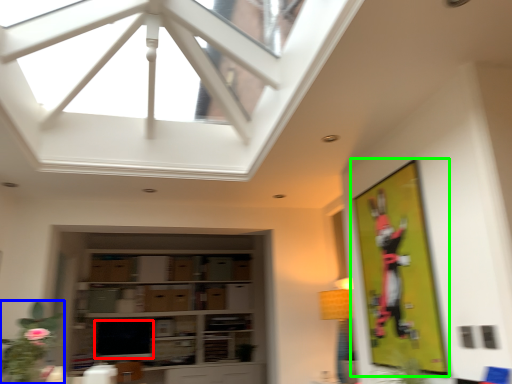
Question: Which object is the closest to the window screen (highlighted by a red box)? Choose among these: plant (highlighted by a blue box) or bulletin board (highlighted by a green box).

Choices:
 (A) plant
 (B) bulletin board

Answer: (A)